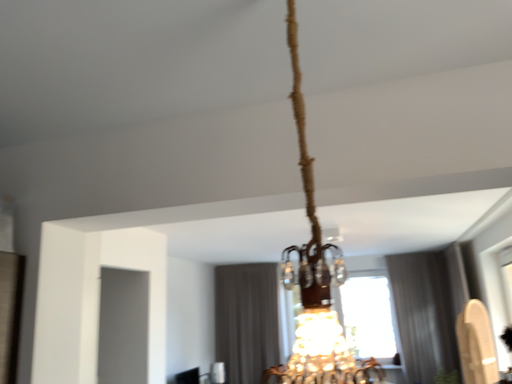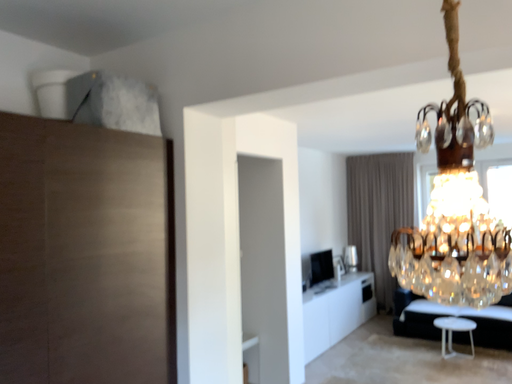
Question: Which way did the camera rotate in the video?

Choices:
 (A) rotated right
 (B) rotated left

Answer: (B)